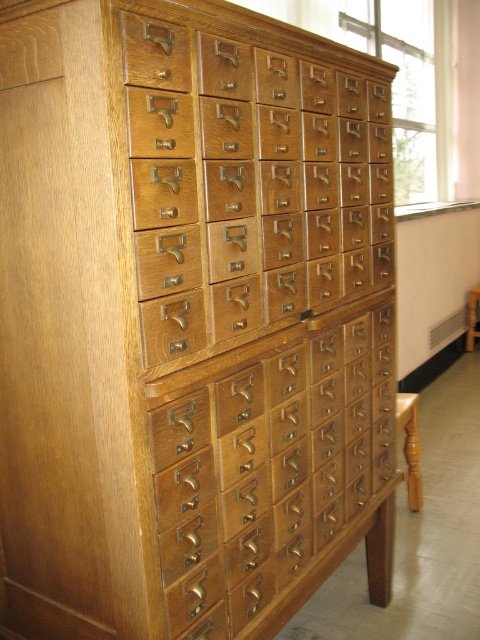
Which is more to the right, matte wood drawer at center or light brown wood drawer at center?

From the viewer's perspective, light brown wood drawer at center appears more on the right side.

Image resolution: width=480 pixels, height=640 pixels. Find the location of `matte wood drawer at center`. matte wood drawer at center is located at coordinates pyautogui.click(x=251, y=182).